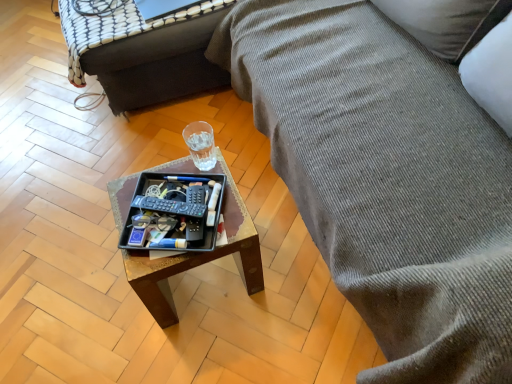
Identify the location of free point above black plastic tray at center (from a real-world perspective). This screenshot has width=512, height=384. (174, 211).